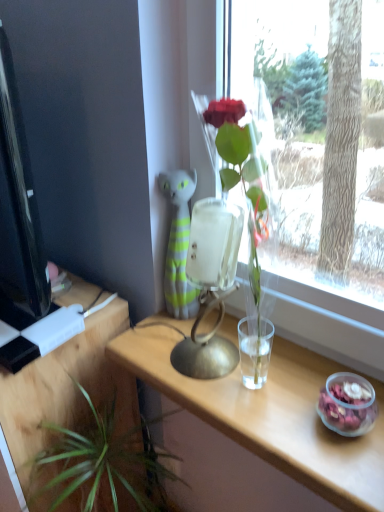
The height and width of the screenshot is (512, 384). In order to click on vacant area in front of metallic gold table lamp at center in this screenshot , I will do `click(230, 413)`.